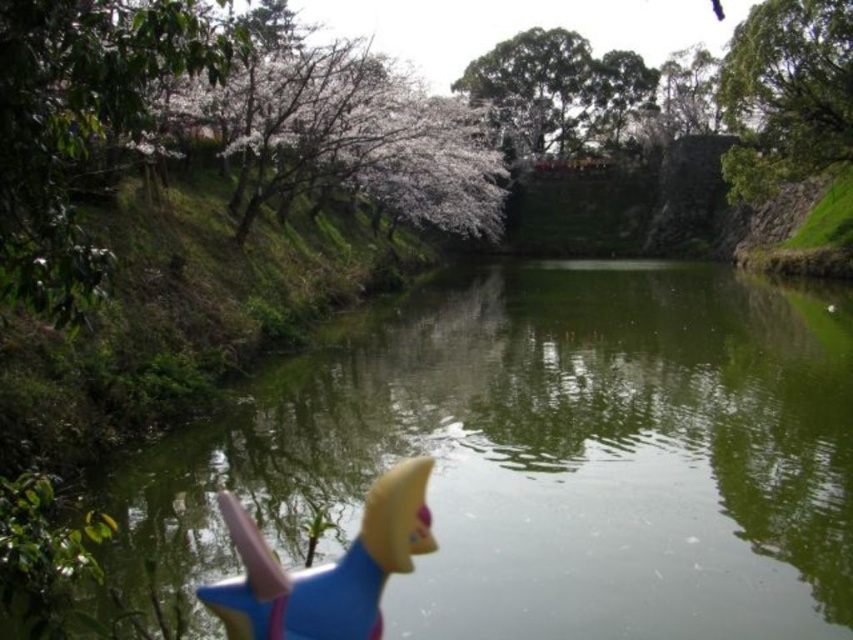
You are a photographer trying to capture the blue rubber toy at lower center without the green leafy tree at upper right blocking it. Can you move the toy forward so it is in front of the tree?

The blue rubber toy at lower center is currently behind the green leafy tree at upper right, so moving it forward would place it in front of the tree, allowing you to capture it without obstruction.

You are a child who wants to throw the blue rubber toy at lower center into the green smooth water at center. Can you reach the water from where you are standing next to the toy?

The green smooth water at center might be wider than blue rubber toy at lower center, so it is possible that the distance is sufficient for the child to throw the toy into the water. However, without exact measurements, we can only assume based on the width comparison provided.

In the scene shown: You are a child who wants to retrieve the blue rubber toy at lower center from the green smooth water at center. Based on their sizes, can you reach the toy without getting your shoes wet?

The green smooth water at center is much taller than the blue rubber toy at lower center, so the water is deeper there. Since the toy is partially submerged, you might need to wade into the water, which could get your shoes wet.